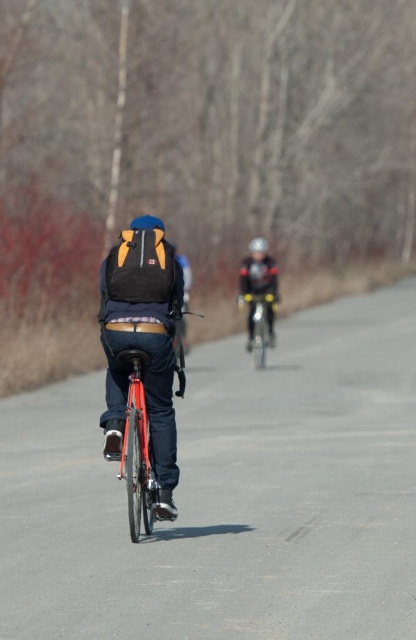
Which is more to the right, metallic silver bicycle at center or matte black helmet at center?

Positioned to the right is matte black helmet at center.

Between metallic silver bicycle at center and matte black helmet at center, which one has less height?

With less height is metallic silver bicycle at center.

Is point (262, 348) more distant than point (250, 250)?

No, it is in front of (250, 250).

Where is `metallic silver bicycle at center`? The width and height of the screenshot is (416, 640). metallic silver bicycle at center is located at coordinates (259, 324).

Between point (252, 273) and point (252, 253), which one is positioned behind?

The point (252, 253) is more distant.

Is shiny black helmet at center taller than matte black helmet at center?

No.

The width and height of the screenshot is (416, 640). Find the location of `shiny black helmet at center`. shiny black helmet at center is located at coordinates (259, 298).

Can you confirm if shiny black helmet at center is taller than metallic silver bicycle at center?

No.

The width and height of the screenshot is (416, 640). Describe the element at coordinates (259, 298) in the screenshot. I see `shiny black helmet at center` at that location.

Is point (274, 262) behind point (250, 301)?

Yes.

At what (x,y) coordinates should I click in order to perform the action: click on shiny black helmet at center. Please return your answer as a coordinate pair (x, y). The height and width of the screenshot is (640, 416). Looking at the image, I should click on (259, 298).